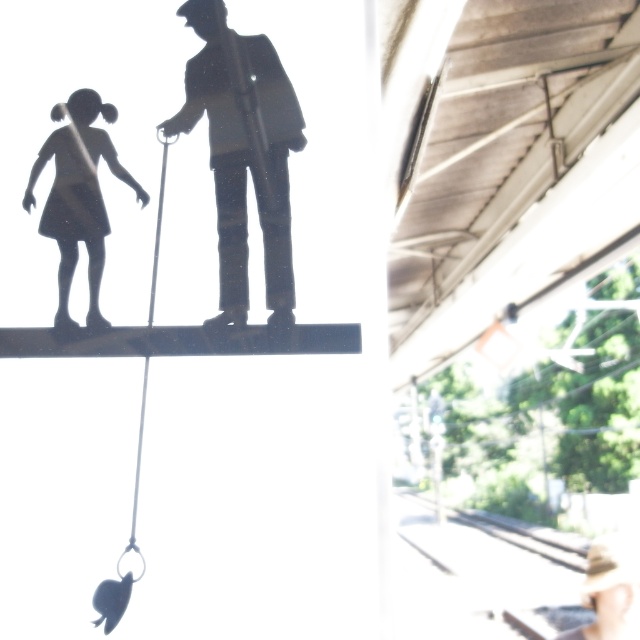
What are the coordinates of the silhouette figure at center?

The silhouette figure at center is located at point [243,154].

You are a painter standing in front of a large canvas. You see the silhouette figure at center and the matte black figure at left. Which figure is closer to you?

The silhouette figure at center is closer to you because it is only 5.59 inches away from the matte black figure at left, which is further away.